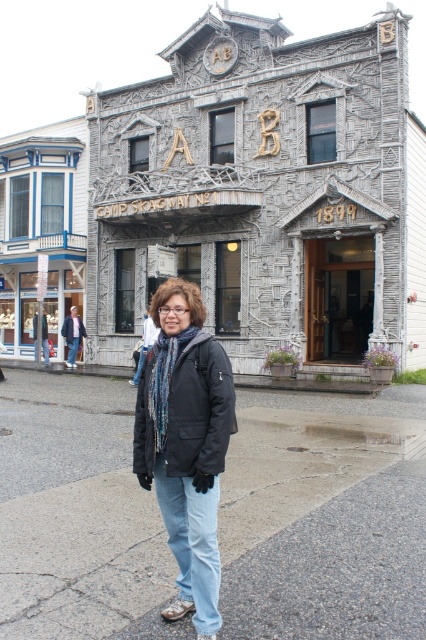
Question: Among these objects, which one is nearest to the camera?

Choices:
 (A) gray stone building at center
 (B) gray asphalt pavement at lower center
 (C) black matte jacket at center

Answer: (C)

Question: Where is gray stone building at center located in relation to black matte jacket at center in the image?

Choices:
 (A) right
 (B) left

Answer: (B)

Question: Is gray stone building at center closer to the viewer compared to black matte jacket at center?

Choices:
 (A) yes
 (B) no

Answer: (B)

Question: Which of these objects is positioned farthest from the gray asphalt pavement at lower center?

Choices:
 (A) gray stone building at center
 (B) matte black jacket at center

Answer: (A)

Question: Which object is positioned closest to the gray asphalt pavement at lower center?

Choices:
 (A) black matte jacket at center
 (B) matte black jacket at center

Answer: (B)

Question: Can you confirm if gray asphalt pavement at lower center is positioned to the right of black matte jacket at center?

Choices:
 (A) no
 (B) yes

Answer: (B)